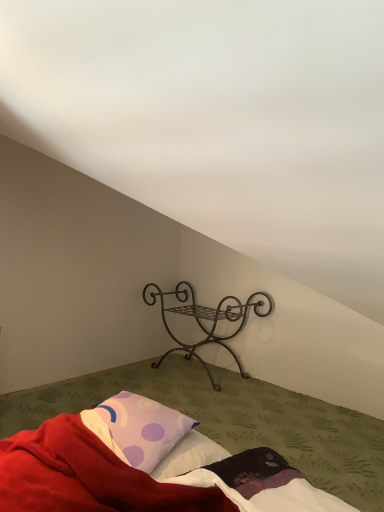
Question: Is point (190, 423) closer or farther from the camera than point (152, 293)?

Choices:
 (A) farther
 (B) closer

Answer: (B)

Question: Based on their sizes in the image, would you say purple dotted pillow at lower left is bigger or smaller than dark brown wrought iron stand at center?

Choices:
 (A) small
 (B) big

Answer: (A)

Question: Considering the real-world distances, which object is farthest from the purple dotted pillow at lower left?

Choices:
 (A) dark brown wrought iron stand at center
 (B) soft cotton bed at center

Answer: (A)

Question: Which of these objects is positioned farthest from the soft cotton bed at center?

Choices:
 (A) dark brown wrought iron stand at center
 (B) purple dotted pillow at lower left

Answer: (A)